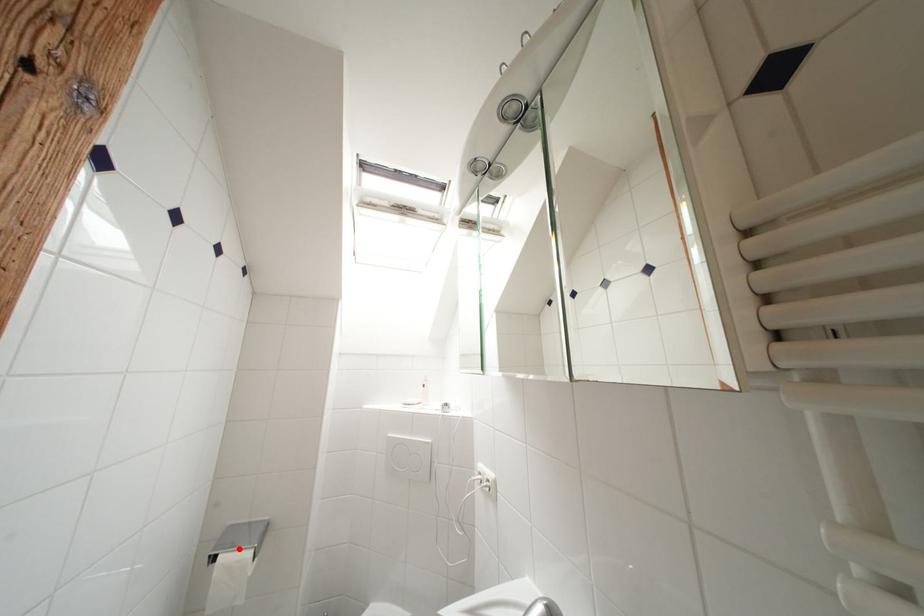
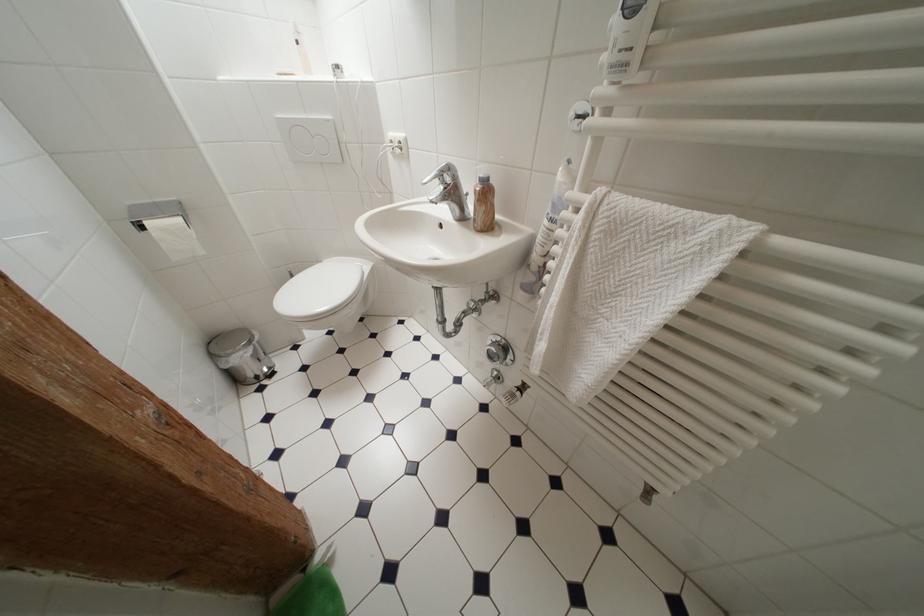
In the second image, find the point that corresponds to the highlighted location in the first image.

(160, 219)